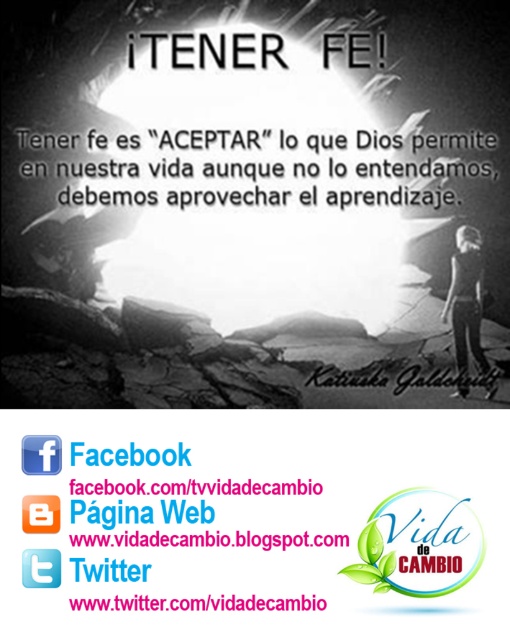
Does black leather pants at right have a larger size compared to orange plastic square at upper center?

Indeed, black leather pants at right has a larger size compared to orange plastic square at upper center.

Does black leather pants at right have a lesser height compared to orange plastic square at upper center?

Incorrect, black leather pants at right's height does not fall short of orange plastic square at upper center's.

I want to click on black leather pants at right, so click(x=467, y=308).

Who is taller, green leafy logo at center or black leather pants at right?

With more height is black leather pants at right.

Does green leafy logo at center have a greater width compared to black leather pants at right?

Yes, green leafy logo at center is wider than black leather pants at right.

This screenshot has height=640, width=510. In order to click on green leafy logo at center in this screenshot , I will do `click(419, 545)`.

Image resolution: width=510 pixels, height=640 pixels. In order to click on green leafy logo at center in this screenshot , I will do `click(419, 545)`.

Is green leafy logo at center further to the viewer compared to white text on transparent background at lower center?

Yes, it is behind white text on transparent background at lower center.

Between green leafy logo at center and white text on transparent background at lower center, which one has more height?

Standing taller between the two is green leafy logo at center.

Describe the element at coordinates (419, 545) in the screenshot. This screenshot has width=510, height=640. I see `green leafy logo at center` at that location.

Where is `green leafy logo at center`? This screenshot has height=640, width=510. green leafy logo at center is located at coordinates (419, 545).